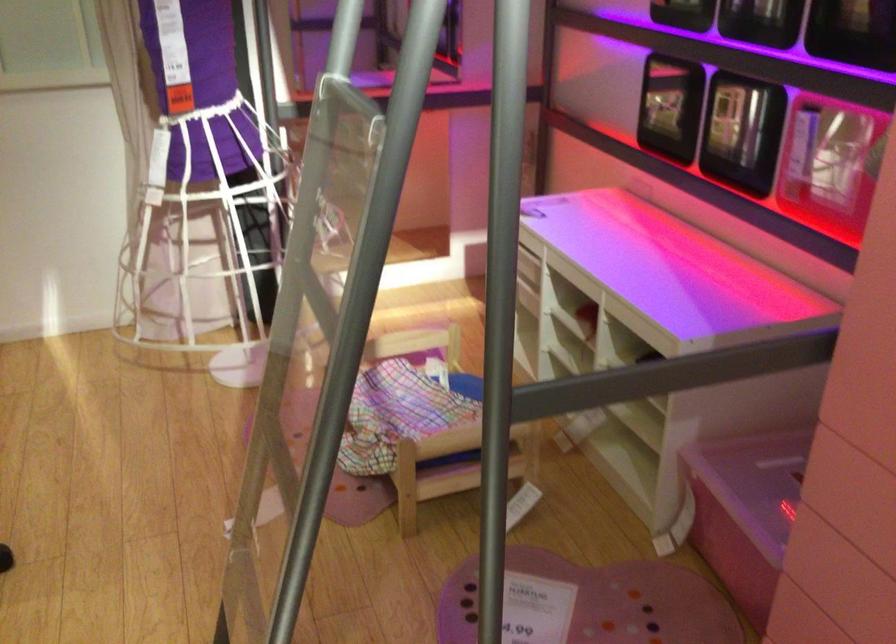
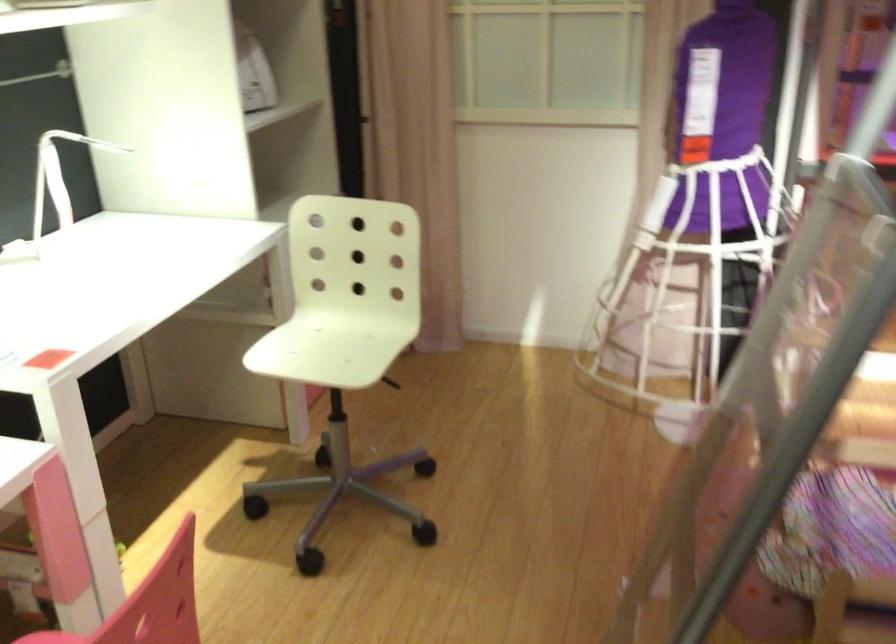
Question: How did the camera likely rotate?

Choices:
 (A) Left
 (B) Right
 (C) Up
 (D) Down

Answer: (A)